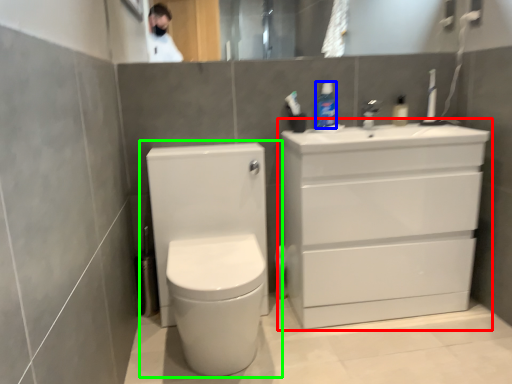
Question: Which object is positioned farthest from bathroom cabinet (highlighted by a red box)? Select from toiletry (highlighted by a blue box) and toilet (highlighted by a green box).

Choices:
 (A) toiletry
 (B) toilet

Answer: (A)